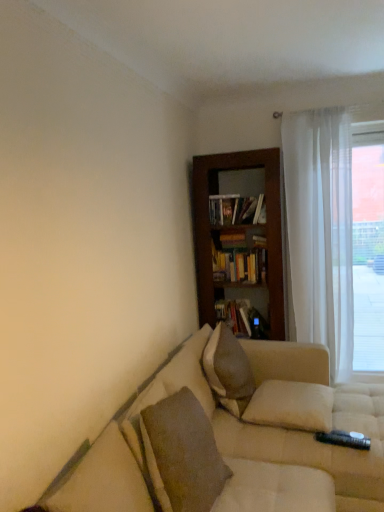
Question: Is beige fabric couch at lower right positioned beyond the bounds of white sheer curtain at right?

Choices:
 (A) no
 (B) yes

Answer: (B)

Question: Does beige fabric couch at lower right lie behind white sheer curtain at right?

Choices:
 (A) yes
 (B) no

Answer: (B)

Question: Does beige fabric couch at lower right have a larger size compared to white sheer curtain at right?

Choices:
 (A) no
 (B) yes

Answer: (B)

Question: From a real-world perspective, is beige fabric couch at lower right below white sheer curtain at right?

Choices:
 (A) yes
 (B) no

Answer: (A)

Question: From the image's perspective, would you say beige fabric couch at lower right is shown under white sheer curtain at right?

Choices:
 (A) yes
 (B) no

Answer: (A)

Question: From a real-world perspective, is transparent curtain at right positioned above or below beige fabric couch at lower right?

Choices:
 (A) below
 (B) above

Answer: (B)

Question: In the image, is transparent curtain at right on the left side or the right side of beige fabric couch at lower right?

Choices:
 (A) right
 (B) left

Answer: (A)

Question: Based on their sizes in the image, would you say transparent curtain at right is bigger or smaller than beige fabric couch at lower right?

Choices:
 (A) big
 (B) small

Answer: (B)

Question: Is transparent curtain at right taller or shorter than beige fabric couch at lower right?

Choices:
 (A) short
 (B) tall

Answer: (B)

Question: In terms of height, does white sheer curtain at right look taller or shorter compared to textured beige pillow at center, which is counted as the third pillow, starting from the front?

Choices:
 (A) tall
 (B) short

Answer: (A)

Question: Does point (307, 307) appear closer or farther from the camera than point (228, 399)?

Choices:
 (A) farther
 (B) closer

Answer: (A)

Question: Is white sheer curtain at right to the left or to the right of textured beige pillow at center, the first pillow from the back, in the image?

Choices:
 (A) right
 (B) left

Answer: (A)

Question: From the image's perspective, is white sheer curtain at right located above or below textured beige pillow at center, which is counted as the third pillow, starting from the front?

Choices:
 (A) below
 (B) above

Answer: (B)

Question: In terms of height, does white soft pillow at center, the 2th pillow when ordered from front to back, look taller or shorter compared to wooden bookshelf at center?

Choices:
 (A) short
 (B) tall

Answer: (A)

Question: From the image's perspective, relative to wooden bookshelf at center, is white soft pillow at center, the 2th pillow when ordered from front to back, above or below?

Choices:
 (A) above
 (B) below

Answer: (B)